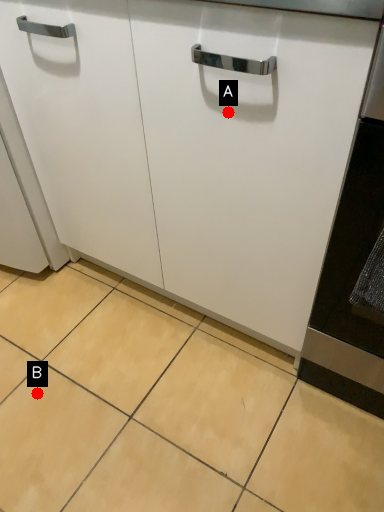
Question: Two points are circled on the image, labeled by A and B beside each circle. Which point is closer to the camera taking this photo?

Choices:
 (A) A is closer
 (B) B is closer

Answer: (A)